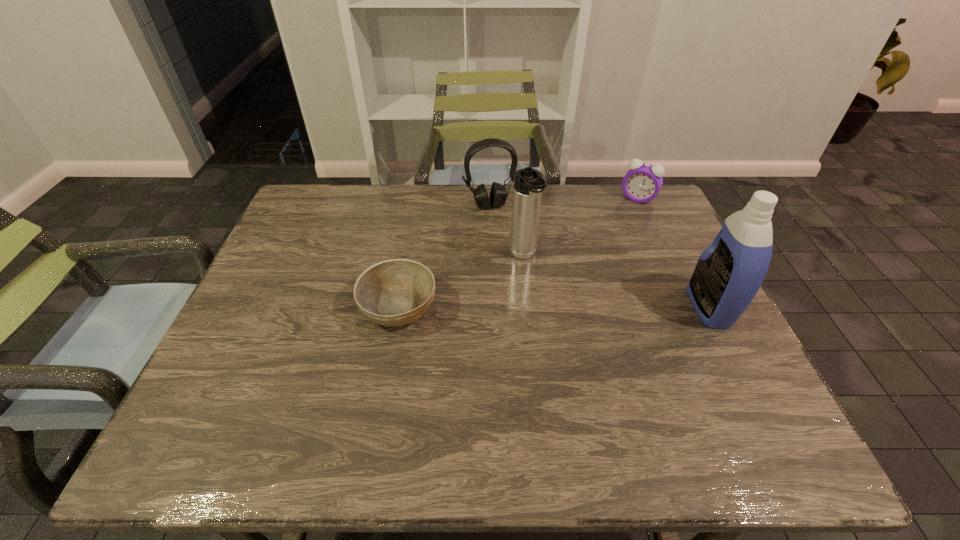
Identify the location of free space on the desktop that is between the bowl and the tallest object and is positioned on the face of the alarm clock. The image size is (960, 540). (576, 307).

The height and width of the screenshot is (540, 960). Find the location of `vacant spot on the desktop that is between the bowl and the tallest object and is positioned on the front-facing side of the headset`. vacant spot on the desktop that is between the bowl and the tallest object and is positioned on the front-facing side of the headset is located at coordinates (521, 307).

Identify the location of free space on the desktop that is between the leftmost object and the tallest object and is positioned on the handle side of the thermos bottle. The image size is (960, 540). (549, 307).